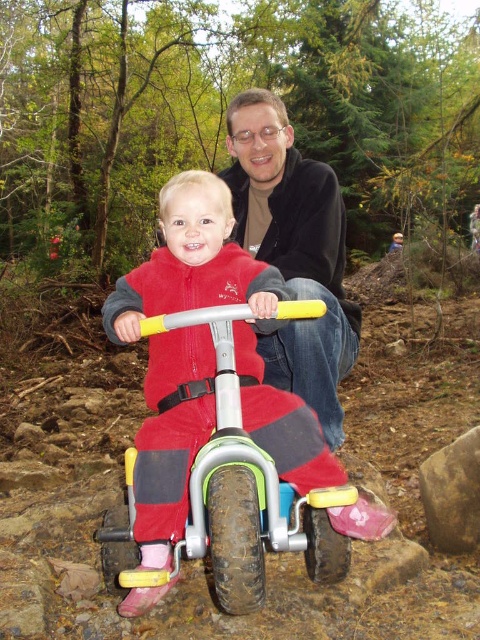
Question: Among these objects, which one is nearest to the camera?

Choices:
 (A) brown rough rock at lower right
 (B) rubberized plastic tricycle at center

Answer: (B)

Question: Which of the following is the farthest from the observer?

Choices:
 (A) (229, 532)
 (B) (460, 531)
 (C) (228, 152)

Answer: (C)

Question: Is rubberized plastic tricycle at center closer to the viewer compared to matte black jacket at upper center?

Choices:
 (A) no
 (B) yes

Answer: (B)

Question: Which point is farther from the camera taking this photo?

Choices:
 (A) (195, 513)
 (B) (295, 349)
 (C) (433, 499)

Answer: (C)

Question: Does matte black jacket at upper center have a lesser width compared to brown rough rock at lower right?

Choices:
 (A) yes
 (B) no

Answer: (B)

Question: Does matte black jacket at upper center appear on the left side of brown rough rock at lower right?

Choices:
 (A) no
 (B) yes

Answer: (B)